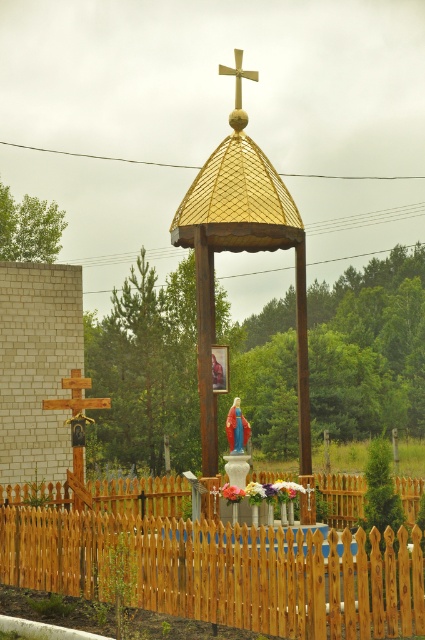
Can you confirm if gold textured dome at center is positioned to the right of gold metallic cross at upper center?

No, gold textured dome at center is not to the right of gold metallic cross at upper center.

Based on the photo, who is shorter, gold textured dome at center or gold metallic cross at upper center?

gold textured dome at center

Who is more distant from viewer, [243,140] or [255,76]?

The point [255,76] is behind.

Locate an element on the screen. The width and height of the screenshot is (425, 640). gold textured dome at center is located at coordinates (240, 250).

Can you confirm if wooden picket fence at center is positioned above matte blue statue at center?

No, wooden picket fence at center is not above matte blue statue at center.

Does point (224, 602) lie behind point (237, 424)?

No.

The width and height of the screenshot is (425, 640). I want to click on wooden picket fence at center, so click(215, 566).

This screenshot has width=425, height=640. In order to click on wooden picket fence at center in this screenshot , I will do `click(215, 566)`.

Who is taller, wooden picket fence at center or gold textured dome at center?

gold textured dome at center is taller.

Is point (382, 596) in front of point (254, 227)?

That is True.

You are a GUI agent. You are given a task and a screenshot of the screen. Output one action in this format:
    pyautogui.click(x=<x>, y=<y>)
    Task: Click on the wooden picket fence at center
    
    Given the screenshot: What is the action you would take?
    pyautogui.click(x=215, y=566)